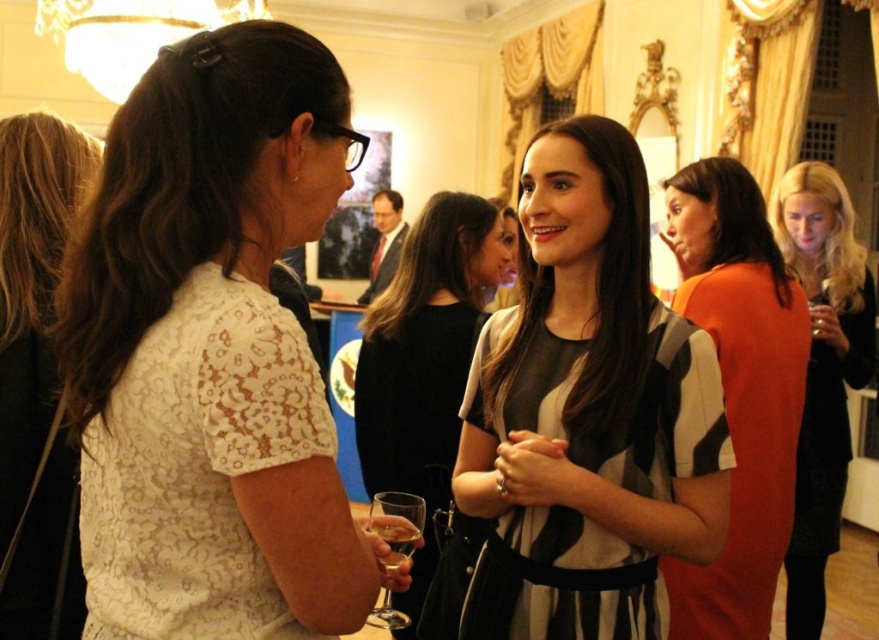
Between white lace dress at left and striped fabric dress at center, which one has less height?

white lace dress at left is shorter.

Is point (135, 401) in front of point (382, 320)?

Yes.

Is point (251, 224) farther from viewer compared to point (442, 497)?

That is False.

Where is `white lace dress at left`? This screenshot has width=879, height=640. white lace dress at left is located at coordinates (211, 353).

Does orange matte dress at right have a greater height compared to blonde hair at left?

Correct, orange matte dress at right is much taller as blonde hair at left.

Is orange matte dress at right smaller than blonde hair at left?

No, orange matte dress at right is not smaller than blonde hair at left.

This screenshot has height=640, width=879. What are the coordinates of `orange matte dress at right` in the screenshot? It's located at coord(739,390).

Which is behind, point (654, 401) or point (404, 612)?

Point (404, 612)

Between black and white striped dress at center and clear glass wine glass at lower center, which one has less height?

Standing shorter between the two is clear glass wine glass at lower center.

Locate an element on the screen. This screenshot has width=879, height=640. black and white striped dress at center is located at coordinates (592, 400).

Where is `black and white striped dress at center`? This screenshot has height=640, width=879. black and white striped dress at center is located at coordinates (592, 400).